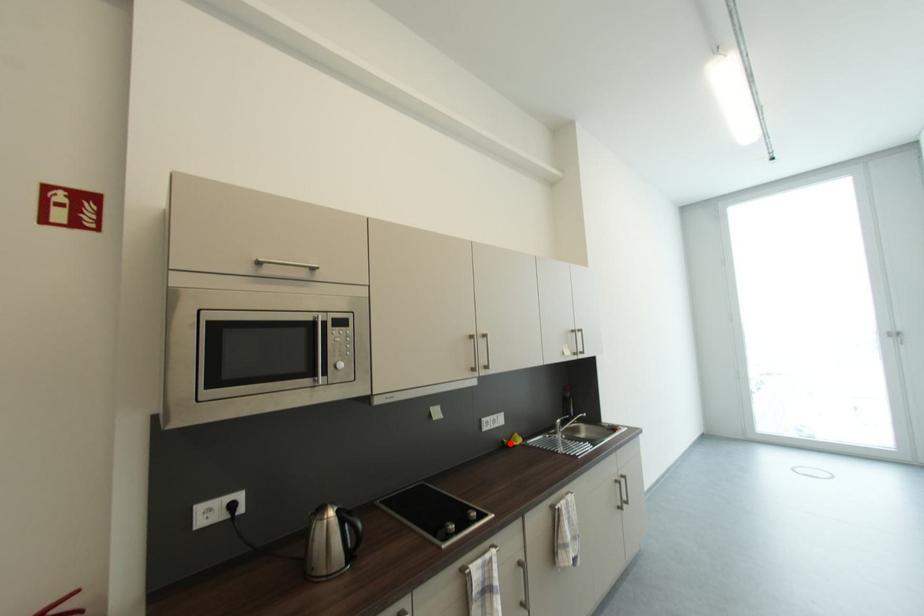
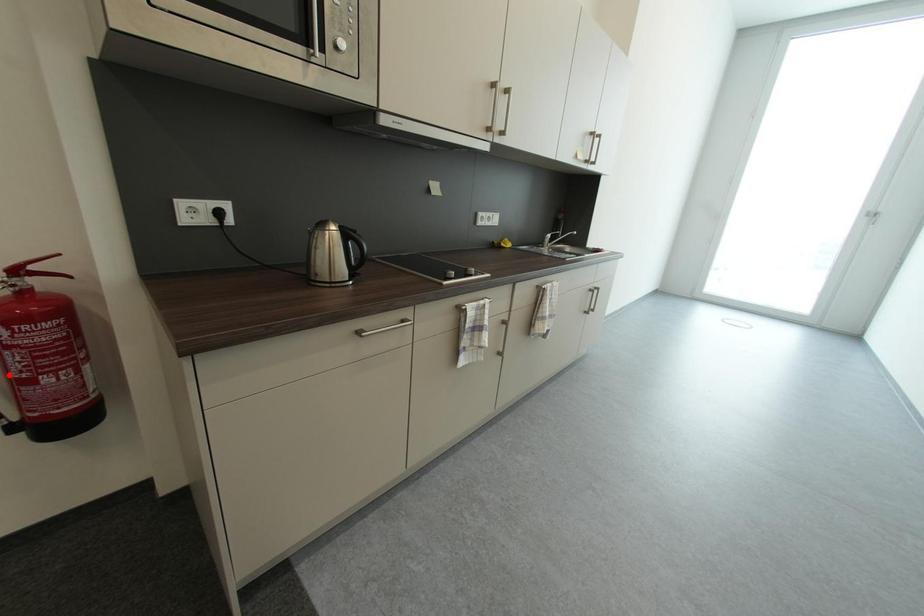
I am providing you with two images of the same scene from different viewpoints. A red point is marked on the first image and another point is marked on the second image. Is the marked point in image1 the same physical position as the marked point in image2?

No